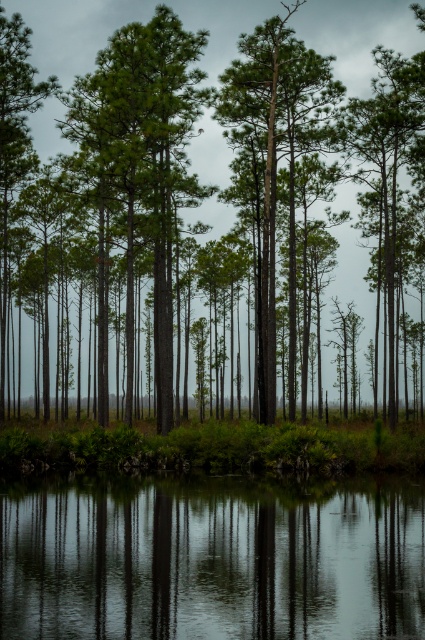
Does clear water at bottom have a smaller size compared to green rough bark tree at center?

Yes.

Identify the location of clear water at bottom. (210, 561).

Is point (113, 600) in front of point (351, 272)?

Yes, it is in front of point (351, 272).

Who is lower down, clear water at bottom or green matte tree at center?

clear water at bottom

This screenshot has width=425, height=640. Identify the location of clear water at bottom. (210, 561).

Does point (192, 12) lie behind point (302, 74)?

Yes, point (192, 12) is farther from viewer.

Between point (121, 12) and point (291, 344), which one is positioned behind?

The point (121, 12) is more distant.

Where is `green matte tree at center`? green matte tree at center is located at coordinates (357, 33).